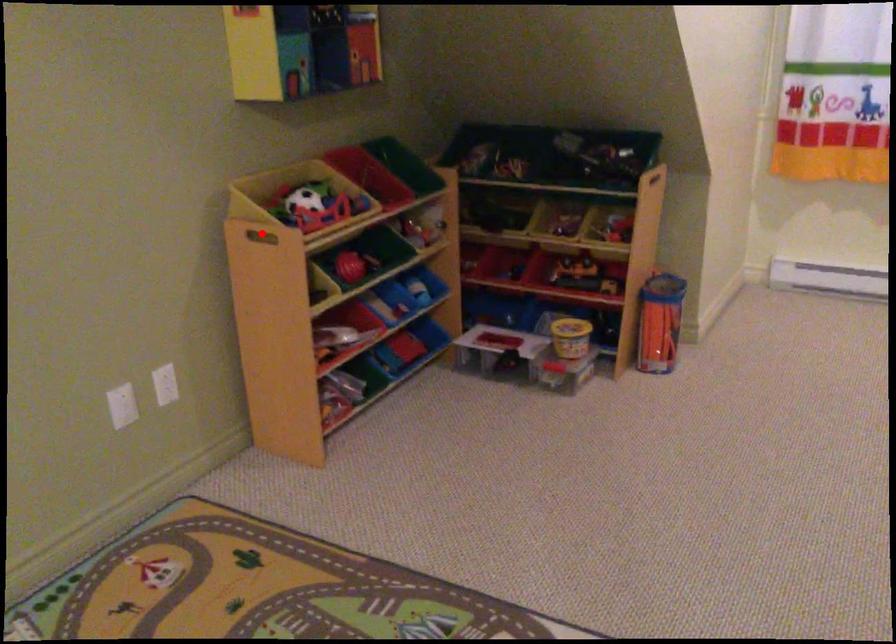
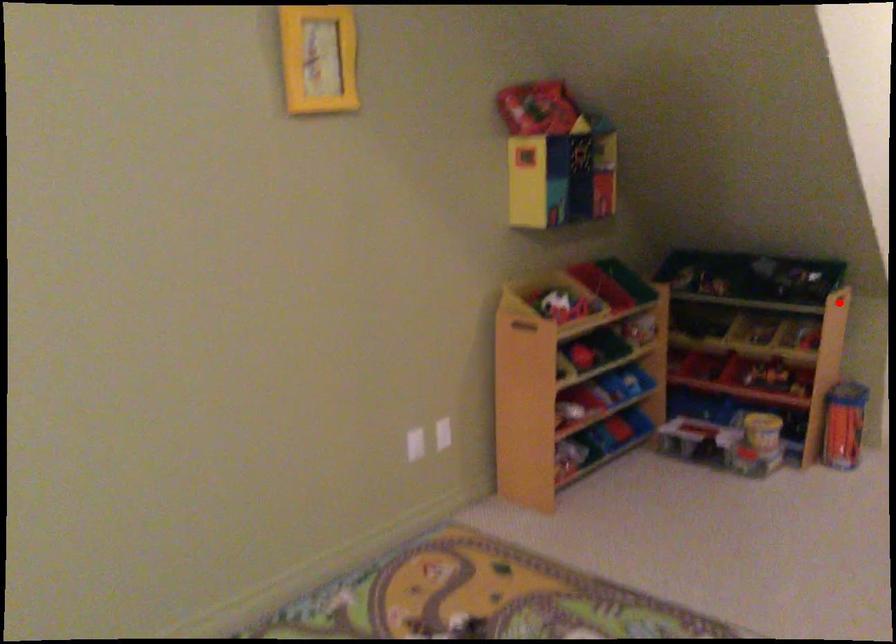
From the picture: I am providing you with two images of the same scene from different viewpoints. A red point is marked on the first image and another point is marked on the second image. Are the points marked in image1 and image2 representing the same 3D position?

No